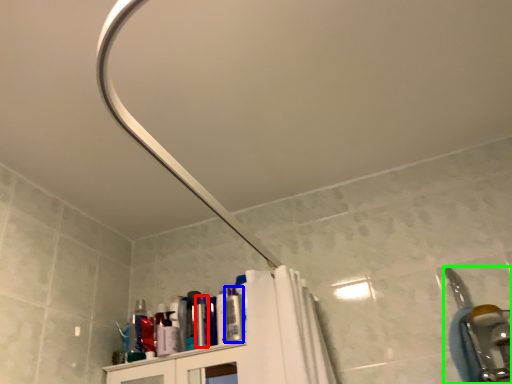
Question: Which object is the closest to the toiletry (highlighted by a red box)? Choose among these: toiletry (highlighted by a blue box) or plumbing fixture (highlighted by a green box).

Choices:
 (A) toiletry
 (B) plumbing fixture

Answer: (A)